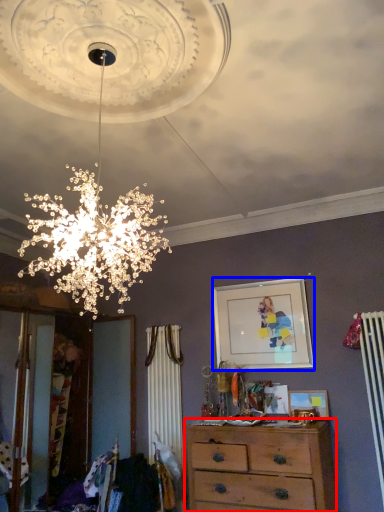
Question: Which object appears closest to the camera in this image, chest of drawers (highlighted by a red box) or picture frame (highlighted by a blue box)?

Choices:
 (A) chest of drawers
 (B) picture frame

Answer: (A)